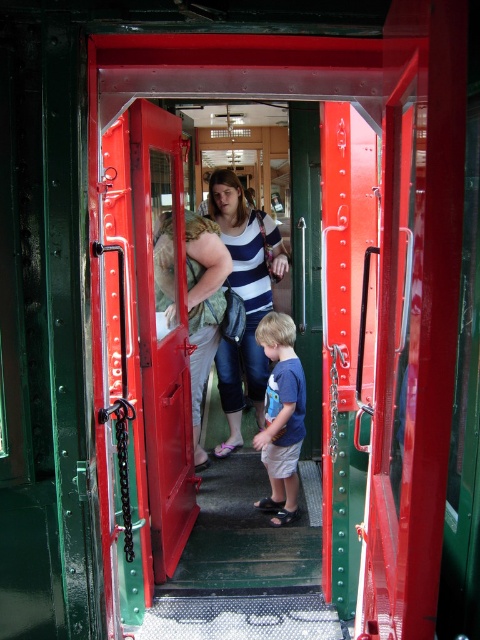
I want to click on metallic red door at center, so click(x=165, y=337).

Does metallic red door at center appear under striped fabric shirt at center?

Indeed, metallic red door at center is positioned under striped fabric shirt at center.

Measure the distance between metallic red door at center and camera.

They are 2.34 meters apart.

At what (x,y) coordinates should I click in order to perform the action: click on metallic red door at center. Please return your answer as a coordinate pair (x, y). This screenshot has height=640, width=480. Looking at the image, I should click on (165, 337).

Which is below, metallic red door at center or metallic grid stair at center?

metallic grid stair at center is below.

Between metallic red door at center and metallic grid stair at center, which one has more height?

Standing taller between the two is metallic red door at center.

Is point (172, 474) farther from viewer compared to point (139, 634)?

Yes, point (172, 474) is behind point (139, 634).

Identify the location of metallic red door at center. (165, 337).

Does striped fabric shirt at center appear under blue cotton shirt at center?

No.

How much distance is there between striped fabric shirt at center and blue cotton shirt at center?

striped fabric shirt at center and blue cotton shirt at center are 27.51 inches apart.

Does point (233, 250) come behind point (280, 356)?

Yes.

Where is `striped fabric shirt at center`? striped fabric shirt at center is located at coordinates (243, 298).